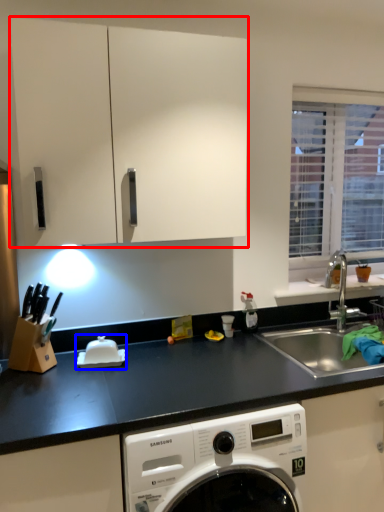
Question: Which object is further to the camera taking this photo, cabinetry (highlighted by a red box) or appliance (highlighted by a blue box)?

Choices:
 (A) cabinetry
 (B) appliance

Answer: (B)